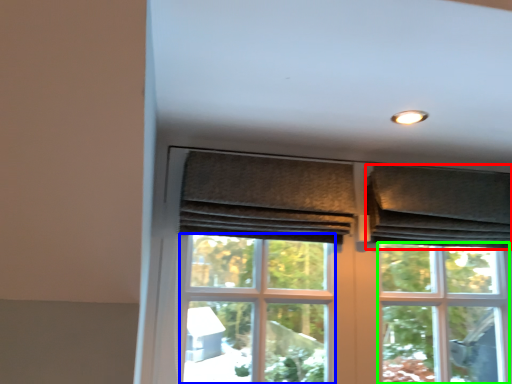
Question: Estimate the real-world distances between objects in this image. Which object is farther from curtain (highlighted by a red box), screen door (highlighted by a blue box) or bay window (highlighted by a green box)?

Choices:
 (A) screen door
 (B) bay window

Answer: (A)